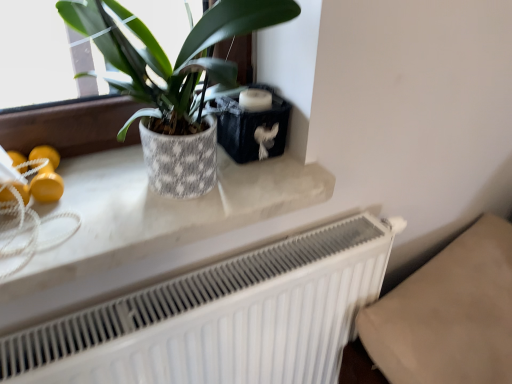
Question: From a real-world perspective, is white matte radiator at lower center beneath textured ceramic pot at upper left?

Choices:
 (A) yes
 (B) no

Answer: (A)

Question: Considering the relative sizes of white matte radiator at lower center and textured ceramic pot at upper left in the image provided, is white matte radiator at lower center taller than textured ceramic pot at upper left?

Choices:
 (A) no
 (B) yes

Answer: (B)

Question: Considering the relative sizes of white matte radiator at lower center and textured ceramic pot at upper left in the image provided, is white matte radiator at lower center shorter than textured ceramic pot at upper left?

Choices:
 (A) no
 (B) yes

Answer: (A)

Question: Is white matte radiator at lower center oriented away from textured ceramic pot at upper left?

Choices:
 (A) no
 (B) yes

Answer: (A)

Question: Can you confirm if white matte radiator at lower center is positioned to the right of textured ceramic pot at upper left?

Choices:
 (A) no
 (B) yes

Answer: (B)

Question: Looking at the image, does textured ceramic pot at upper left seem bigger or smaller compared to white marble counter top at upper center?

Choices:
 (A) big
 (B) small

Answer: (A)

Question: Is textured ceramic pot at upper left wider or thinner than white marble counter top at upper center?

Choices:
 (A) thin
 (B) wide

Answer: (B)

Question: From the image's perspective, is textured ceramic pot at upper left positioned above or below white marble counter top at upper center?

Choices:
 (A) above
 (B) below

Answer: (A)

Question: Does point (144, 29) appear closer or farther from the camera than point (174, 263)?

Choices:
 (A) farther
 (B) closer

Answer: (B)

Question: From the image's perspective, relative to white matte radiator at lower center, is textured ceramic pot at upper left above or below?

Choices:
 (A) above
 (B) below

Answer: (A)

Question: Looking at their shapes, would you say textured ceramic pot at upper left is wider or thinner than white matte radiator at lower center?

Choices:
 (A) wide
 (B) thin

Answer: (A)

Question: Is textured ceramic pot at upper left taller or shorter than white matte radiator at lower center?

Choices:
 (A) tall
 (B) short

Answer: (B)

Question: Which is correct: textured ceramic pot at upper left is inside white matte radiator at lower center, or outside of it?

Choices:
 (A) outside
 (B) inside

Answer: (A)

Question: Is white matte radiator at lower center bigger or smaller than textured ceramic pot at upper left?

Choices:
 (A) small
 (B) big

Answer: (B)

Question: From a real-world perspective, relative to textured ceramic pot at upper left, is white matte radiator at lower center vertically above or below?

Choices:
 (A) above
 (B) below

Answer: (B)